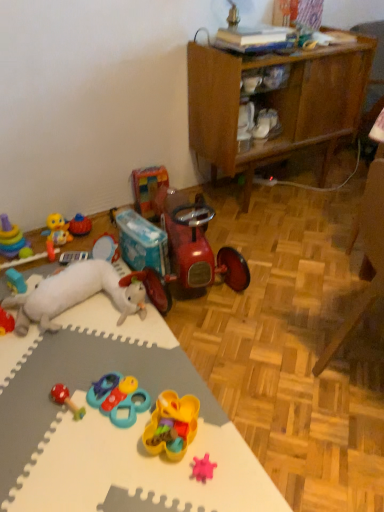
You are a GUI agent. You are given a task and a screenshot of the screen. Output one action in this format:
    pyautogui.click(x=<x>, y=<y>)
    Task: Click on the free space between teal plastic toy at center, the 5th toy viewed from the right, and rubber teething ring at lower left, which is the 10th toy from right to left
    
    Given the screenshot: What is the action you would take?
    pyautogui.click(x=77, y=349)